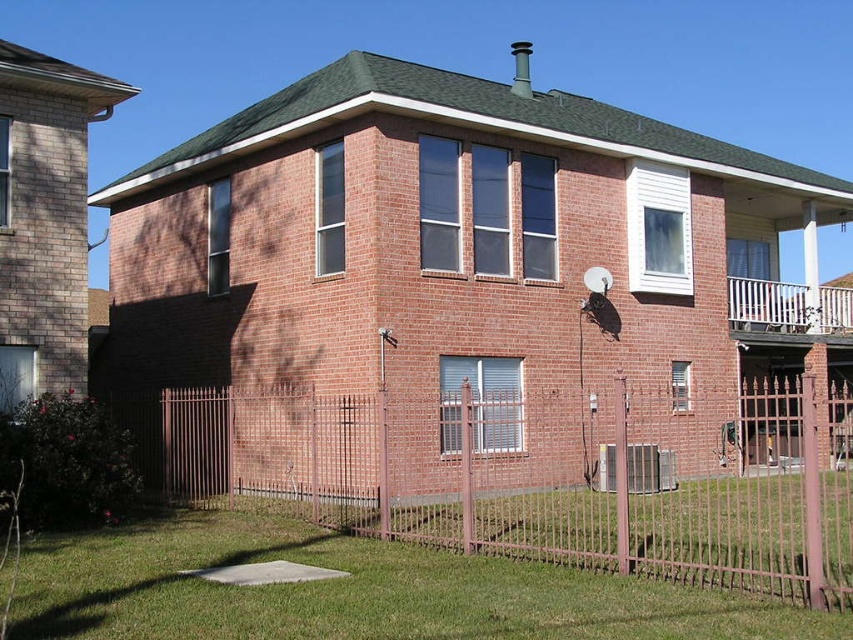
You are a gardener standing in the front yard of the house. You need to place a new garden statue that is 2 meters wide between the green grass at lower center and the metallic silver basketball hoop at upper right. Is there enough space between them for the statue?

The green grass at lower center is positioned on the left side of metallic silver basketball hoop at upper right, but the distance between them isn not specified. Without knowing the exact distance, it is impossible to determine if the 2 meter wide statue can fit between them.

You are a gardener who wants to plant a row of flowers between the green grass at lower center and the metallic silver basketball hoop at upper right. Which area has more space available for planting?

The metallic silver basketball hoop at upper right has more space available for planting since the green grass at lower center is thinner, indicating less space.